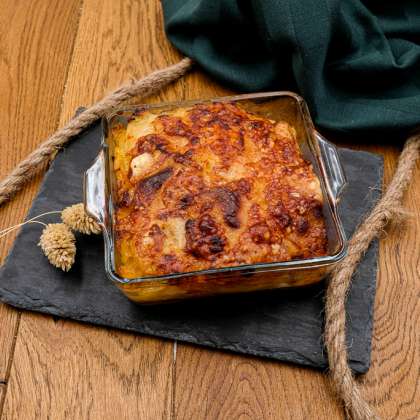
Where is `glass`? The image size is (420, 420). glass is located at coordinates (270, 278).